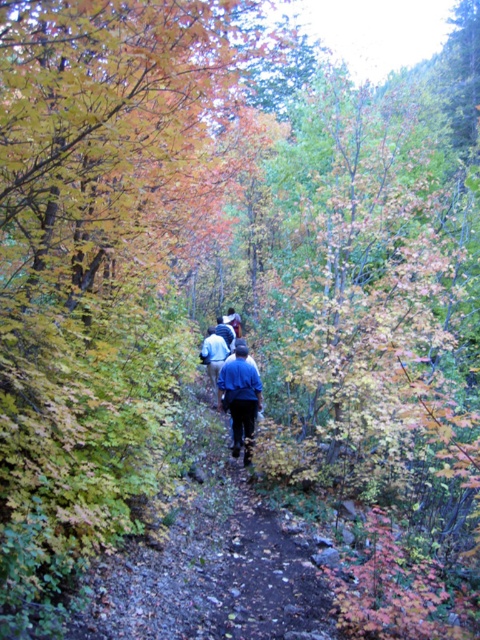
Is blue denim jacket at center thinner than blue fabric jacket at center?

No, blue denim jacket at center is not thinner than blue fabric jacket at center.

Between blue denim jacket at center and blue fabric jacket at center, which one is positioned higher?

blue fabric jacket at center

What do you see at coordinates (240, 396) in the screenshot? I see `blue denim jacket at center` at bounding box center [240, 396].

At what (x,y) coordinates should I click in order to perform the action: click on blue denim jacket at center. Please return your answer as a coordinate pair (x, y). Looking at the image, I should click on (240, 396).